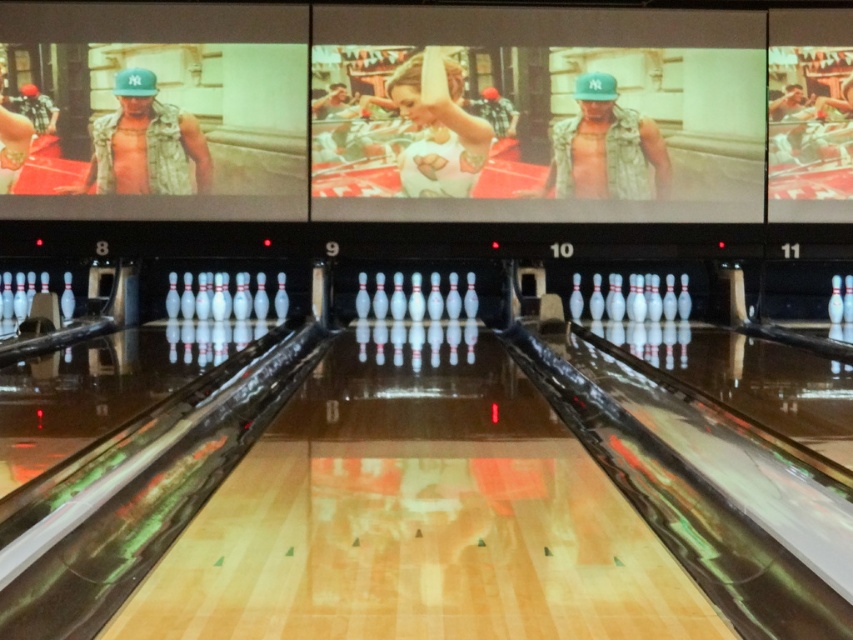
You are a customer at a bowling alley and see two vests available for rent. The camouflage vest at center and the matte black vest at upper left. Which vest is bigger in size?

The camouflage vest at center has a larger size compared to the matte black vest at upper left.

You are a bowler standing at the approach area of lane 9. You notice two vests near the lane. Which vest is closer to you, the camouflage vest at center or the matte black vest at upper left?

The camouflage vest at center is closer to you because the matte black vest at upper left is behind it.

You are a customer at a formal event and see the matte white dress at center and the matte black vest at upper left. Which clothing item is positioned closer to the front of the scene?

The matte white dress at center is positioned closer to the front of the scene because the matte black vest at upper left is behind it.